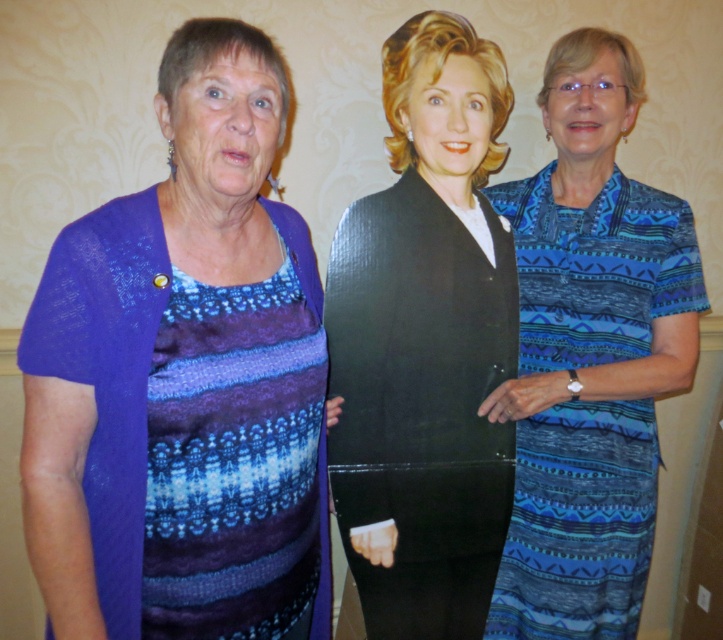
Question: From the image, what is the correct spatial relationship of knitted purple cardigan at left in relation to blue printed dress at right?

Choices:
 (A) right
 (B) left

Answer: (B)

Question: Which object is farther from the camera taking this photo?

Choices:
 (A) black glossy vest at center
 (B) knitted purple cardigan at left
 (C) blue printed dress at right

Answer: (C)

Question: Can you confirm if knitted purple cardigan at left is positioned to the left of blue printed dress at right?

Choices:
 (A) yes
 (B) no

Answer: (A)

Question: Is knitted purple cardigan at left to the right of black glossy vest at center from the viewer's perspective?

Choices:
 (A) no
 (B) yes

Answer: (A)

Question: Which object is farther from the camera taking this photo?

Choices:
 (A) blue printed dress at right
 (B) knitted purple cardigan at left
 (C) black glossy vest at center

Answer: (A)

Question: Among these points, which one is farthest from the camera?

Choices:
 (A) (422, 42)
 (B) (521, 595)

Answer: (B)